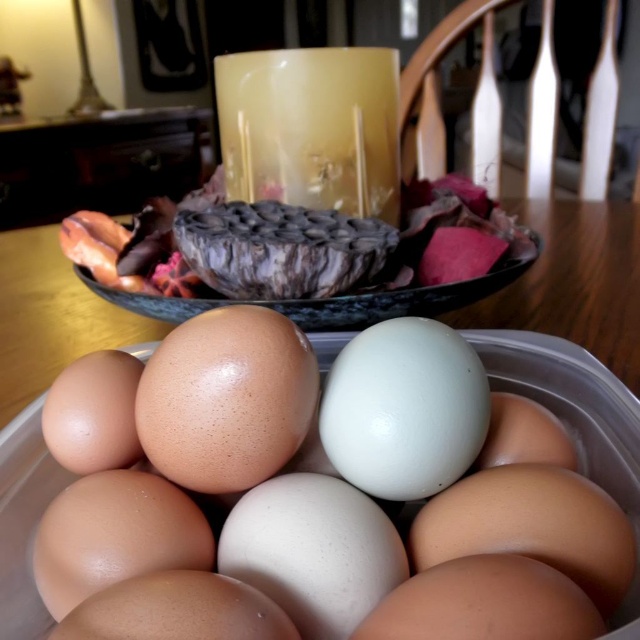
Question: Which point is closer to the camera taking this photo?

Choices:
 (A) (365, 355)
 (B) (358, 205)
 (C) (250, 88)
 (D) (224, 467)

Answer: (D)

Question: Among these objects, which one is farthest from the camera?

Choices:
 (A) white glossy egg at center
 (B) matte yellow candle at upper center
 (C) translucent glass candle at center
 (D) brown matte egg at center

Answer: (B)

Question: Which point appears farthest from the camera in this image?

Choices:
 (A) (141, 596)
 (B) (444, 378)

Answer: (B)

Question: Is matte brown egg at center below matte yellow candle at upper center?

Choices:
 (A) no
 (B) yes

Answer: (B)

Question: Does brown matte egg at center have a smaller size compared to white glossy egg at center?

Choices:
 (A) no
 (B) yes

Answer: (B)

Question: Is translucent glass candle at center wider than matte yellow candle at upper center?

Choices:
 (A) yes
 (B) no

Answer: (A)